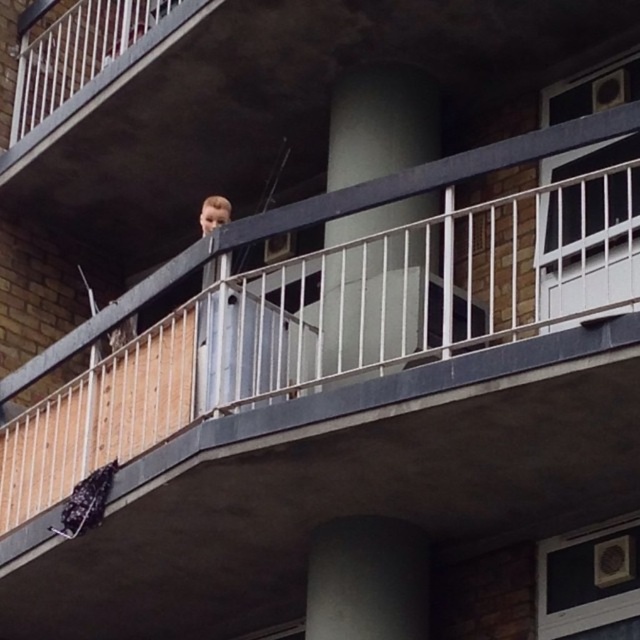
Question: Does white smooth pillar at center appear on the right side of blonde hair at center?

Choices:
 (A) no
 (B) yes

Answer: (B)

Question: Where is smooth concrete pillar at center located in relation to blonde hair at center in the image?

Choices:
 (A) left
 (B) right

Answer: (B)

Question: Which point is closer to the camera taking this photo?

Choices:
 (A) (422, 586)
 (B) (204, 228)
 (C) (420, 232)

Answer: (C)

Question: Can you confirm if white smooth pillar at center is wider than blonde hair at center?

Choices:
 (A) yes
 (B) no

Answer: (A)

Question: Which point appears closest to the camera in this image?

Choices:
 (A) (221, 205)
 (B) (336, 557)
 (C) (396, 164)

Answer: (B)

Question: Which object appears closest to the camera in this image?

Choices:
 (A) blonde hair at center
 (B) smooth concrete pillar at center

Answer: (B)